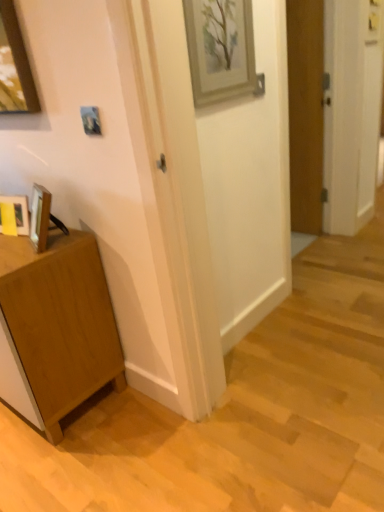
Question: Would you say matte wooden picture frame at lower left, which ranks as the first picture frame in bottom-to-top order, is part of wooden door at right's contents?

Choices:
 (A) yes
 (B) no

Answer: (B)

Question: Can you confirm if wooden door at right is positioned to the right of matte wooden picture frame at lower left, the first picture frame in the left-to-right sequence?

Choices:
 (A) no
 (B) yes

Answer: (B)

Question: Is wooden door at right thinner than matte wooden picture frame at lower left, the 3th picture frame in the right-to-left sequence?

Choices:
 (A) yes
 (B) no

Answer: (A)

Question: Is wooden door at right at the left side of matte wooden picture frame at lower left, which ranks as the first picture frame in bottom-to-top order?

Choices:
 (A) no
 (B) yes

Answer: (A)

Question: Is wooden door at right smaller than matte wooden picture frame at lower left, the first picture frame in the left-to-right sequence?

Choices:
 (A) no
 (B) yes

Answer: (A)

Question: Is light brown wood cabinet at lower left bigger or smaller than metallic silver picture frame at upper center, which ranks as the second picture frame in left-to-right order?

Choices:
 (A) small
 (B) big

Answer: (B)

Question: From the image's perspective, is light brown wood cabinet at lower left above or below metallic silver picture frame at upper center, the second picture frame from the right?

Choices:
 (A) above
 (B) below

Answer: (B)

Question: Does point (92, 268) appear closer or farther from the camera than point (89, 131)?

Choices:
 (A) closer
 (B) farther

Answer: (B)

Question: From a real-world perspective, is light brown wood cabinet at lower left above or below metallic silver picture frame at upper center, positioned as the 2th picture frame in bottom-to-top order?

Choices:
 (A) below
 (B) above

Answer: (A)

Question: Is wooden door at right in front of or behind matte wooden picture frame at lower left, which ranks as the first picture frame in bottom-to-top order, in the image?

Choices:
 (A) front
 (B) behind

Answer: (B)

Question: In terms of width, does wooden door at right look wider or thinner when compared to matte wooden picture frame at lower left, the 3th picture frame in the right-to-left sequence?

Choices:
 (A) thin
 (B) wide

Answer: (A)

Question: Based on their sizes in the image, would you say wooden door at right is bigger or smaller than matte wooden picture frame at lower left, the 3th picture frame in the right-to-left sequence?

Choices:
 (A) small
 (B) big

Answer: (B)

Question: Considering the positions of point (291, 175) and point (19, 204), is point (291, 175) closer or farther from the camera than point (19, 204)?

Choices:
 (A) farther
 (B) closer

Answer: (A)

Question: From a real-world perspective, relative to matte wooden picture frame at lower left, the first picture frame in the left-to-right sequence, is light brown wood cabinet at lower left vertically above or below?

Choices:
 (A) above
 (B) below

Answer: (B)

Question: Is light brown wood cabinet at lower left bigger or smaller than matte wooden picture frame at lower left, the first picture frame in the left-to-right sequence?

Choices:
 (A) big
 (B) small

Answer: (A)